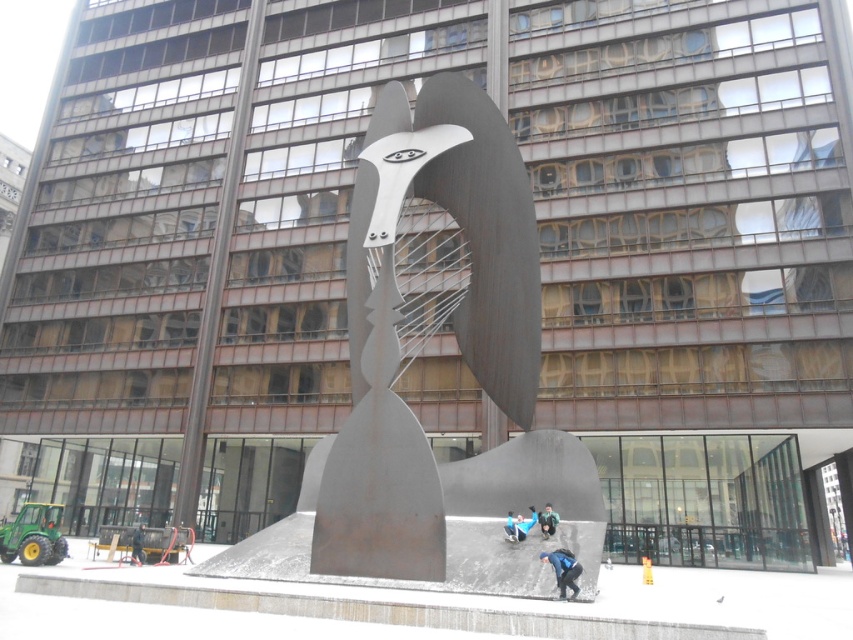
Question: Which object appears closest to the camera in this image?

Choices:
 (A) blue fabric at lower center
 (B) rusty metal sculpture at center

Answer: (A)

Question: Can you confirm if rusty metal sculpture at center is positioned to the left of blue fabric at lower center?

Choices:
 (A) no
 (B) yes

Answer: (B)

Question: Among these objects, which one is farthest from the camera?

Choices:
 (A) blue fabric at lower center
 (B) dark blue jeans at center

Answer: (B)

Question: Is rusty metal sculpture at center above dark blue jeans at center?

Choices:
 (A) no
 (B) yes

Answer: (B)

Question: Considering the relative positions of rusty metal sculpture at center and blue fabric at lower center in the image provided, where is rusty metal sculpture at center located with respect to blue fabric at lower center?

Choices:
 (A) below
 (B) above

Answer: (B)

Question: Which of the following is the farthest from the observer?

Choices:
 (A) rusty metal sculpture at center
 (B) blue fabric at lower center

Answer: (A)